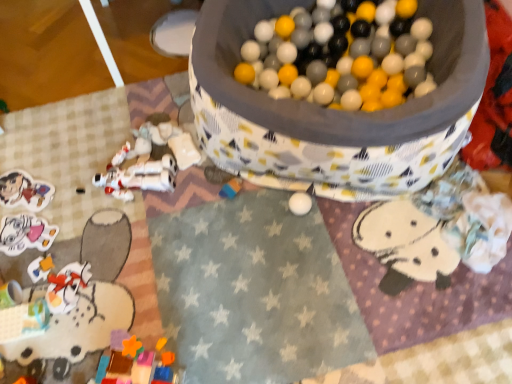
The height and width of the screenshot is (384, 512). What are the coordinates of `free space in front of plastic toy figure at lower left, positioned as the third toy in left-to-right order` in the screenshot? It's located at (48, 347).